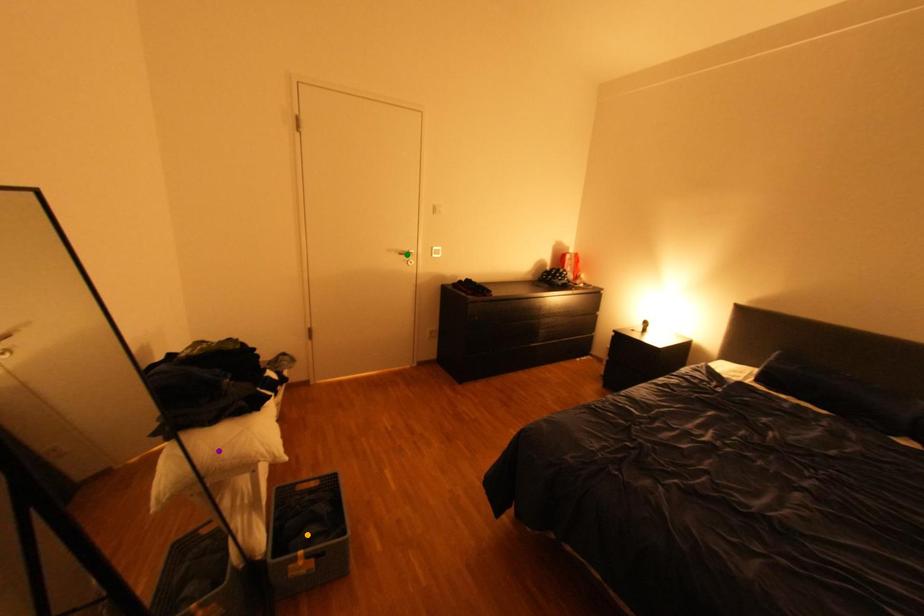
Order these from nearest to farthest:
A) green point
B) orange point
C) purple point

purple point → orange point → green point